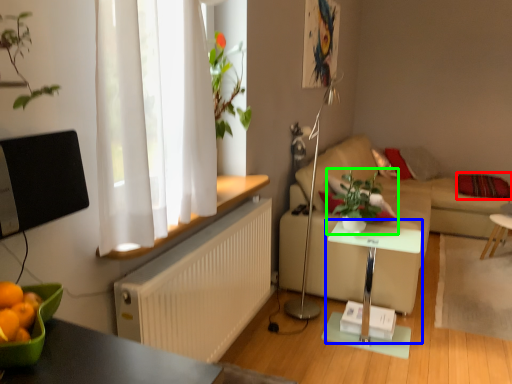
Question: Based on their relative distances, which object is nearer to pillow (highlighted by a red box)? Choose from table (highlighted by a blue box) and houseplant (highlighted by a green box).

Choices:
 (A) table
 (B) houseplant

Answer: (B)